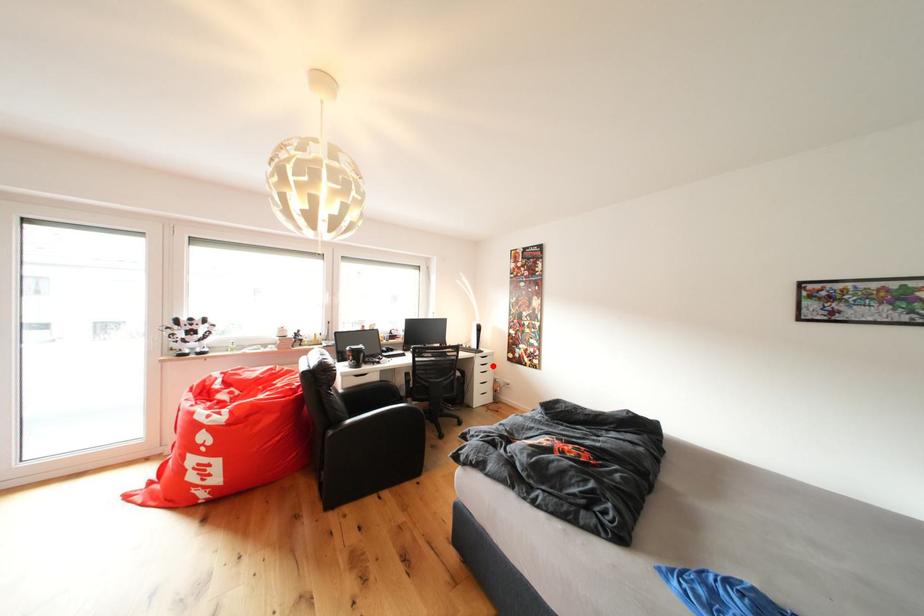
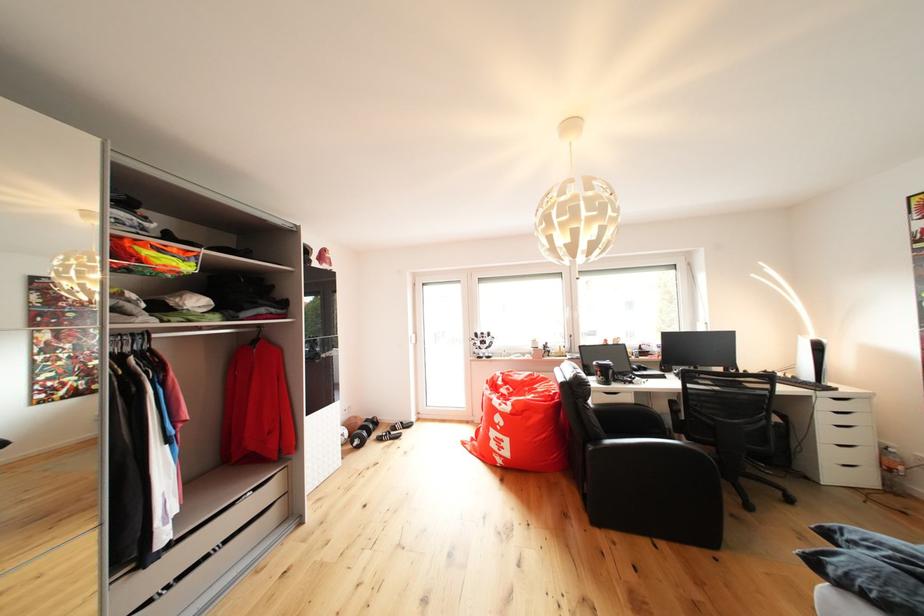
The point at the highlighted location is marked in the first image. Where is the corresponding point in the second image?

(850, 411)